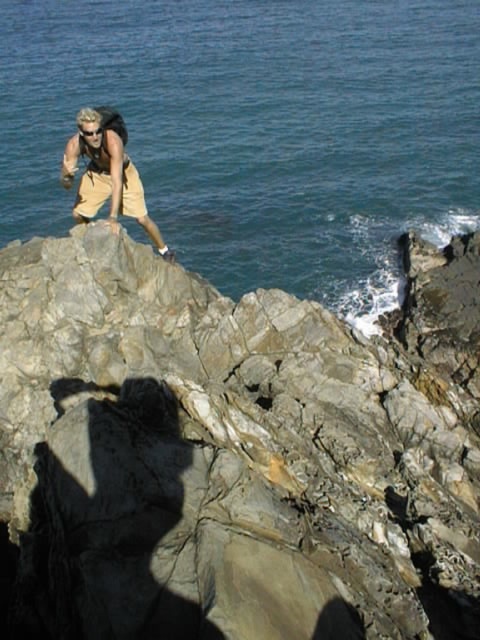
Does blue water at upper center appear on the right side of tan cotton shorts at upper left?

Indeed, blue water at upper center is positioned on the right side of tan cotton shorts at upper left.

Which is below, blue water at upper center or tan cotton shorts at upper left?

tan cotton shorts at upper left

What do you see at coordinates (256, 129) in the screenshot? This screenshot has height=640, width=480. I see `blue water at upper center` at bounding box center [256, 129].

Find the location of a particular element. blue water at upper center is located at coordinates (256, 129).

Is gray rocky cliff at upper left thinner than blue water at upper center?

Indeed, gray rocky cliff at upper left has a lesser width compared to blue water at upper center.

Is gray rocky cliff at upper left below blue water at upper center?

Yes, gray rocky cliff at upper left is below blue water at upper center.

The width and height of the screenshot is (480, 640). I want to click on gray rocky cliff at upper left, so click(233, 451).

Between gray rocky cliff at upper left and tan cotton shorts at upper left, which one has less height?

Standing shorter between the two is gray rocky cliff at upper left.

Is gray rocky cliff at upper left positioned behind tan cotton shorts at upper left?

No.

The height and width of the screenshot is (640, 480). What do you see at coordinates (233, 451) in the screenshot?
I see `gray rocky cliff at upper left` at bounding box center [233, 451].

Where is `gray rocky cliff at upper left`? gray rocky cliff at upper left is located at coordinates (233, 451).